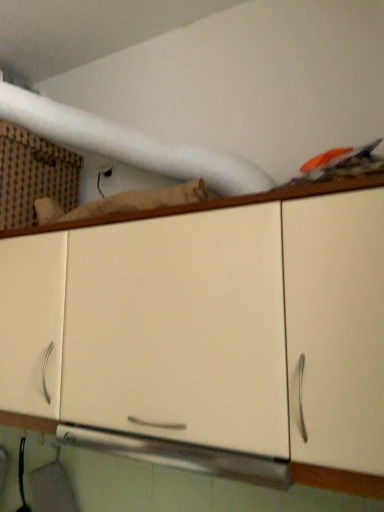
Question: Should I look upward or downward to see patterned cardboard box at upper left?

Choices:
 (A) up
 (B) down

Answer: (A)